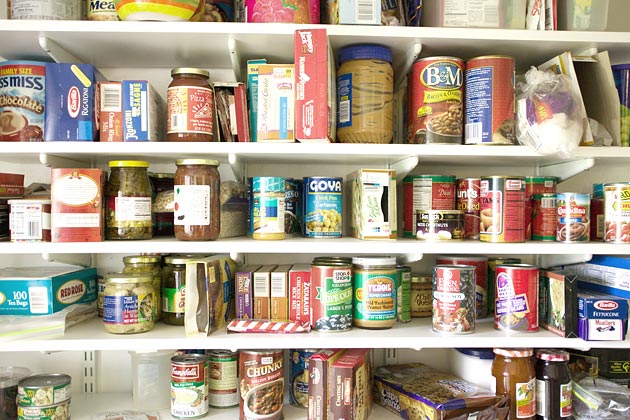
Where is `food in jars`? The image size is (630, 420). food in jars is located at coordinates (175, 112), (365, 95), (196, 202), (137, 211), (121, 306), (138, 267), (171, 286), (559, 393), (515, 380).